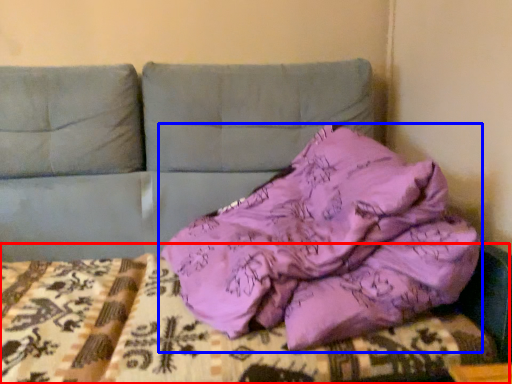
Question: Which object appears closest to the camera in this image, bed frame (highlighted by a red box) or pillow (highlighted by a blue box)?

Choices:
 (A) bed frame
 (B) pillow

Answer: (B)